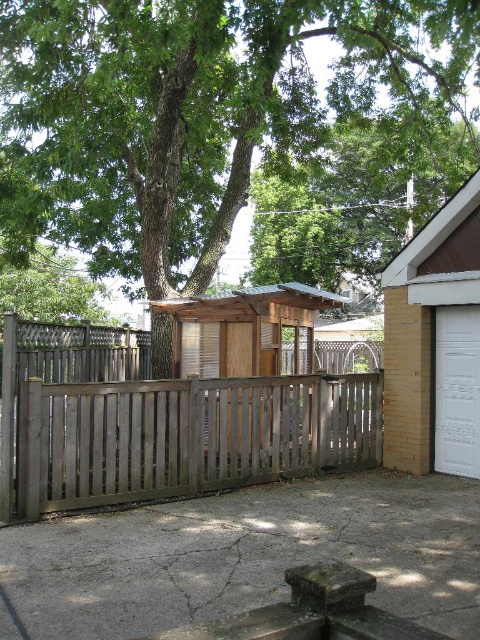
Between green leafy tree at upper center and weathered wood fence at center, which one is positioned lower?

weathered wood fence at center is lower down.

Can you confirm if green leafy tree at upper center is positioned to the left of weathered wood fence at center?

In fact, green leafy tree at upper center is to the right of weathered wood fence at center.

Identify the location of green leafy tree at upper center. The height and width of the screenshot is (640, 480). (189, 112).

Between green leafy tree at upper center and white glossy garage door at right, which one is positioned lower?

Positioned lower is white glossy garage door at right.

Is point (155, 196) positioned after point (447, 381)?

Yes, it is.

You are a GUI agent. You are given a task and a screenshot of the screen. Output one action in this format:
    pyautogui.click(x=<x>, y=<y>)
    Task: Click on the green leafy tree at upper center
    
    Given the screenshot: What is the action you would take?
    pyautogui.click(x=189, y=112)

Describe the element at coordinates (189, 112) in the screenshot. I see `green leafy tree at upper center` at that location.

Is green leafy tree at upper center bigger than brown wood cabin at upper right?

Yes, green leafy tree at upper center is bigger than brown wood cabin at upper right.

Find the location of a particular element. The width and height of the screenshot is (480, 640). green leafy tree at upper center is located at coordinates (189, 112).

Find the location of a particular element. green leafy tree at upper center is located at coordinates (189, 112).